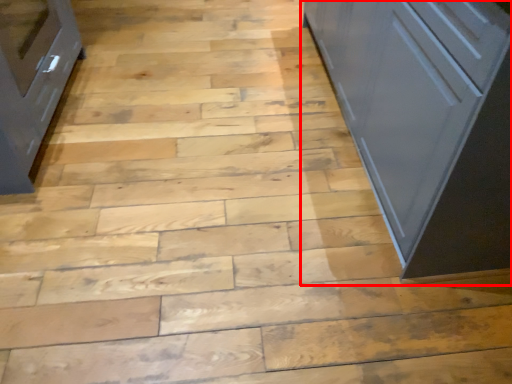
Question: From the image's perspective, what is the correct spatial relationship of cupboard (annotated by the red box) in relation to cabinetry?

Choices:
 (A) below
 (B) above

Answer: (B)